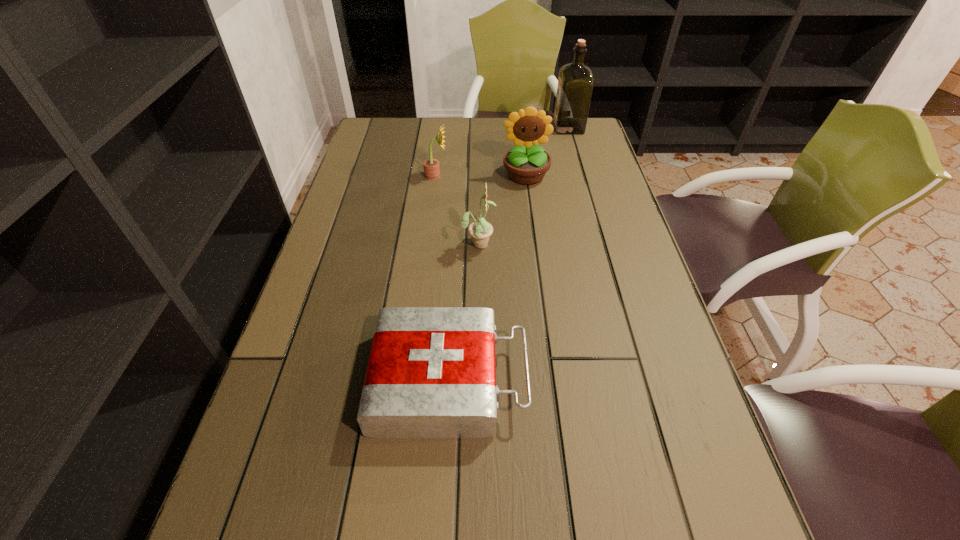
This screenshot has height=540, width=960. Identify the location of free space located 0.110m on the label of the liquor. (523, 127).

At what (x,y) coordinates should I click in order to perform the action: click on free space located 0.400m on the label of the liquor. Please return your answer as a coordinate pair (x, y). The width and height of the screenshot is (960, 540). Looking at the image, I should click on (441, 127).

Find the location of a particular element. This screenshot has width=960, height=540. vacant position located on the face of the second tallest object is located at coordinates (531, 219).

You are a GUI agent. You are given a task and a screenshot of the screen. Output one action in this format:
    pyautogui.click(x=<x>, y=<y>)
    Task: Click on the vacant region located on the front-facing side of the second sunflower from left to right
    This screenshot has height=540, width=960.
    Given the screenshot: What is the action you would take?
    pyautogui.click(x=555, y=243)

Locate an element on the screen. free space located 0.220m on the face of the leftmost sunflower is located at coordinates (519, 176).

Locate an element on the screen. The image size is (960, 540). vacant point located on the front side of the nearest object is located at coordinates (640, 380).

Locate an element on the screen. Image resolution: width=960 pixels, height=540 pixels. object that is at the far edge is located at coordinates (575, 83).

The width and height of the screenshot is (960, 540). I want to click on object that is at the right edge, so click(575, 83).

Where is `object present at the far right corner`? This screenshot has width=960, height=540. object present at the far right corner is located at coordinates (575, 83).

This screenshot has width=960, height=540. In the image, there is a desktop. What are the coordinates of `free region at the far edge` in the screenshot? It's located at (468, 126).